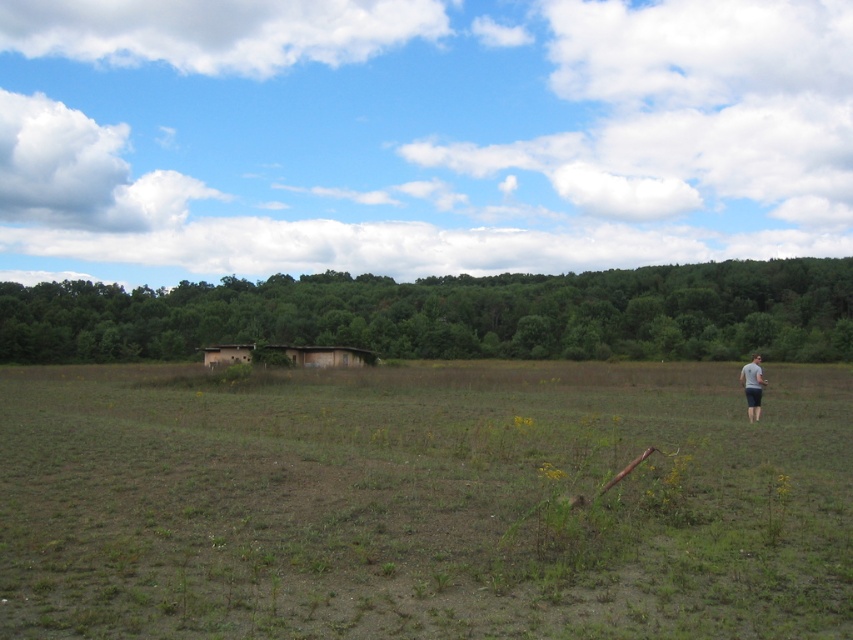
Who is taller, brown dry grass at center or brown wooden hut at center?

Standing taller between the two is brown wooden hut at center.

In the scene shown: Does brown dry grass at center appear under brown wooden hut at center?

Yes, brown dry grass at center is below brown wooden hut at center.

Does point (828, 460) lie in front of point (323, 349)?

Yes, point (828, 460) is closer to viewer.

You are a GUI agent. You are given a task and a screenshot of the screen. Output one action in this format:
    pyautogui.click(x=<x>, y=<y>)
    Task: Click on the brown dry grass at center
    
    Given the screenshot: What is the action you would take?
    pyautogui.click(x=422, y=500)

Can you confirm if brown wooden hut at center is thinner than gray fabric shirt at right?

Yes.

Who is positioned more to the right, brown wooden hut at center or gray fabric shirt at right?

From the viewer's perspective, gray fabric shirt at right appears more on the right side.

The width and height of the screenshot is (853, 640). In order to click on brown wooden hut at center in this screenshot , I will do `click(289, 355)`.

At what (x,y) coordinates should I click in order to perform the action: click on brown wooden hut at center. Please return your answer as a coordinate pair (x, y). The height and width of the screenshot is (640, 853). Looking at the image, I should click on (289, 355).

Does point (80, 580) lie behind point (752, 401)?

No, it is not.

Is brown dry grass at center shorter than gray fabric shirt at right?

Yes, brown dry grass at center is shorter than gray fabric shirt at right.

Is point (294, 538) positioned before point (753, 376)?

Yes, point (294, 538) is closer to viewer.

You are a GUI agent. You are given a task and a screenshot of the screen. Output one action in this format:
    pyautogui.click(x=<x>, y=<y>)
    Task: Click on the brown dry grass at center
    The height and width of the screenshot is (640, 853).
    Given the screenshot: What is the action you would take?
    pyautogui.click(x=422, y=500)